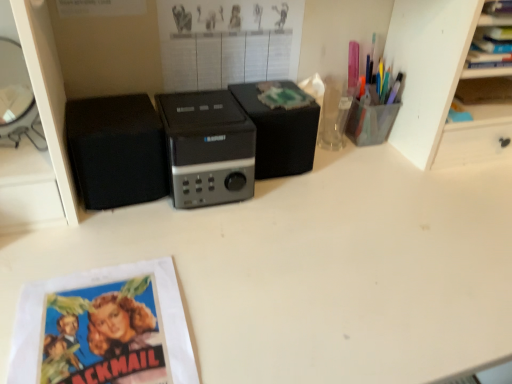
Question: Can you confirm if black matte speaker at center, the 1th speaker when ordered from right to left, is taller than black plastic speaker at center?

Choices:
 (A) yes
 (B) no

Answer: (B)

Question: Is the position of black matte speaker at center, arranged as the second speaker when viewed from the left, more distant than that of black plastic speaker at center?

Choices:
 (A) no
 (B) yes

Answer: (B)

Question: Considering the relative sizes of black matte speaker at center, arranged as the second speaker when viewed from the left, and black plastic speaker at center in the image provided, is black matte speaker at center, arranged as the second speaker when viewed from the left, shorter than black plastic speaker at center?

Choices:
 (A) yes
 (B) no

Answer: (A)

Question: Is black matte speaker at center, arranged as the second speaker when viewed from the left, wider than black plastic speaker at center?

Choices:
 (A) no
 (B) yes

Answer: (A)

Question: From a real-world perspective, relative to blue paper at lower left, is black matte speaker at center, the 1th speaker when ordered from right to left, vertically above or below?

Choices:
 (A) below
 (B) above

Answer: (B)

Question: Is black matte speaker at center, the 1th speaker when ordered from right to left, wider or thinner than blue paper at lower left?

Choices:
 (A) thin
 (B) wide

Answer: (A)

Question: In the image, is black matte speaker at center, the 1th speaker when ordered from right to left, positioned in front of or behind blue paper at lower left?

Choices:
 (A) front
 (B) behind

Answer: (B)

Question: From the image's perspective, is black matte speaker at center, the 1th speaker when ordered from right to left, positioned above or below blue paper at lower left?

Choices:
 (A) below
 (B) above

Answer: (B)

Question: Is blue paper at lower left inside the boundaries of black matte speaker at left, which is the 1th speaker from left to right, or outside?

Choices:
 (A) outside
 (B) inside

Answer: (A)

Question: Looking at the image, does blue paper at lower left seem bigger or smaller compared to black matte speaker at left, positioned as the 2th speaker in right-to-left order?

Choices:
 (A) big
 (B) small

Answer: (B)

Question: From a real-world perspective, relative to black matte speaker at left, positioned as the 2th speaker in right-to-left order, is blue paper at lower left vertically above or below?

Choices:
 (A) below
 (B) above

Answer: (A)

Question: In terms of width, does blue paper at lower left look wider or thinner when compared to black matte speaker at left, positioned as the 2th speaker in right-to-left order?

Choices:
 (A) wide
 (B) thin

Answer: (A)

Question: Considering their positions, is black matte speaker at center, arranged as the second speaker when viewed from the left, located in front of or behind translucent plastic pen holder at upper right?

Choices:
 (A) behind
 (B) front

Answer: (B)

Question: In terms of size, does black matte speaker at center, arranged as the second speaker when viewed from the left, appear bigger or smaller than translucent plastic pen holder at upper right?

Choices:
 (A) small
 (B) big

Answer: (B)